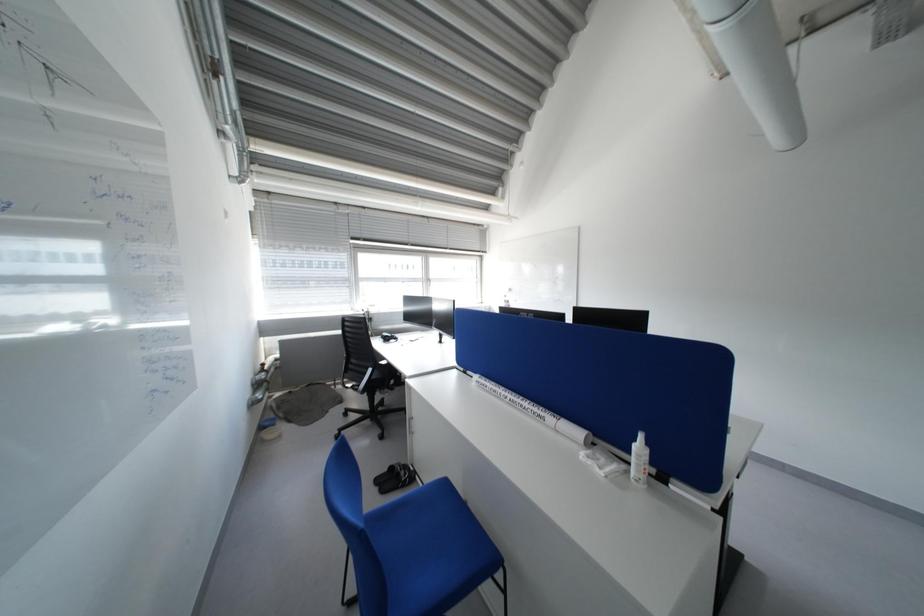
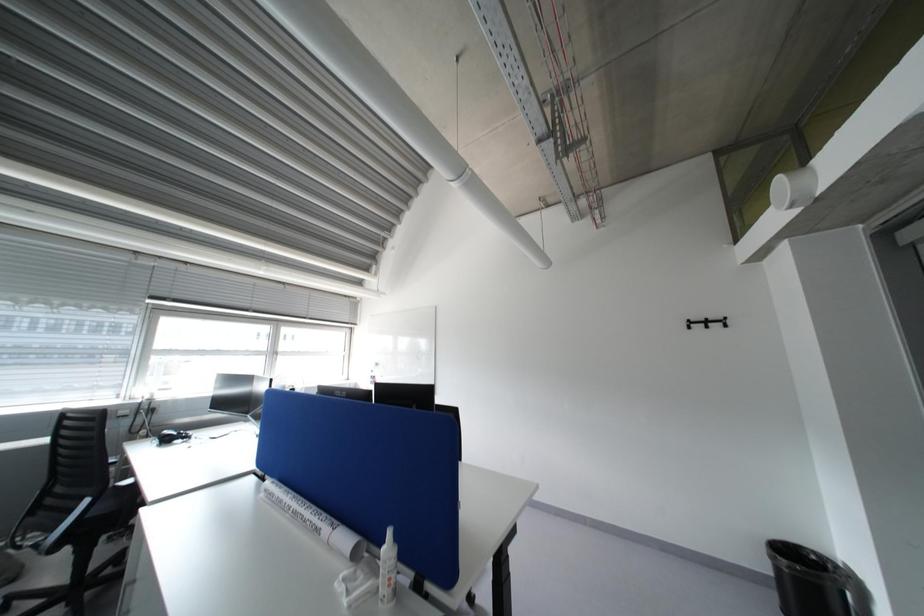
Question: Which direction would the cameraman need to move to produce the second image? Reply with the corresponding letter.

Choices:
 (A) Left
 (B) Right
 (C) Forward
 (D) Backward

Answer: (B)